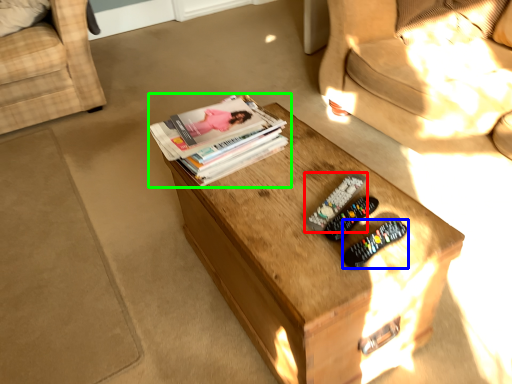
Question: Considering the real-world distances, which object is closest to remote control (highlighted by a red box)? remote control (highlighted by a blue box) or book (highlighted by a green box).

Choices:
 (A) remote control
 (B) book

Answer: (A)